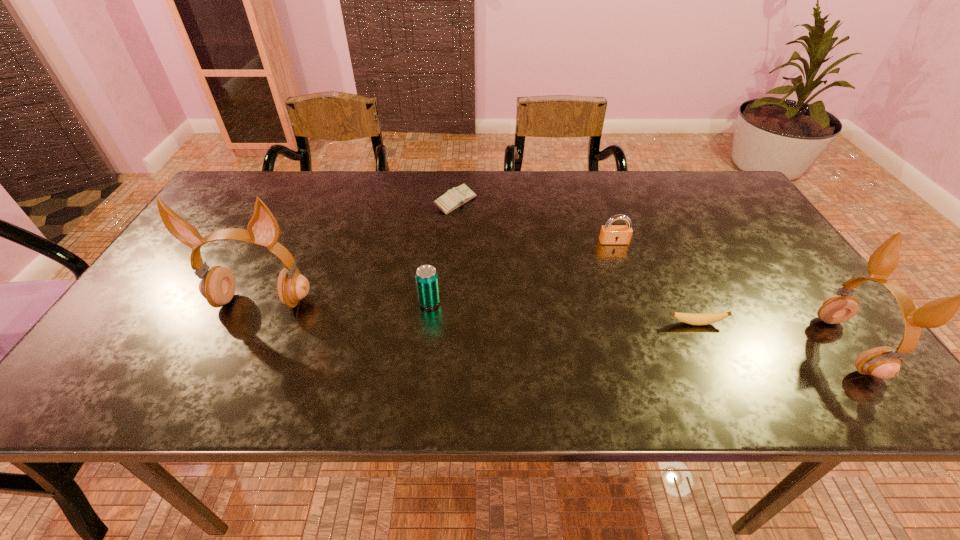
Find the location of a particular element. The height and width of the screenshot is (540, 960). vacant space located on the front of the diary is located at coordinates (448, 300).

Find the location of a particular element. The image size is (960, 540). blank space located on the back of the beer can is located at coordinates (432, 276).

The width and height of the screenshot is (960, 540). I want to click on vacant space situated 0.110m to unlock the padlock from the front, so click(x=624, y=273).

Where is `free space located 0.240m on the back of the fifth object from left to right`? This screenshot has height=540, width=960. free space located 0.240m on the back of the fifth object from left to right is located at coordinates (662, 251).

Find the location of a particular element. object that is at the far edge is located at coordinates (453, 198).

At what (x,y) coordinates should I click in order to perform the action: click on object at the near edge. Please return your answer as a coordinate pair (x, y). The image size is (960, 540). Looking at the image, I should click on (884, 362).

In order to click on object that is at the left edge in this screenshot , I will do `click(217, 286)`.

I want to click on object present at the right edge, so click(x=884, y=362).

You are a GUI agent. You are given a task and a screenshot of the screen. Output one action in this format:
    pyautogui.click(x=<x>, y=<y>)
    Task: Click on the object at the near right corner
    The height and width of the screenshot is (540, 960).
    Given the screenshot: What is the action you would take?
    pyautogui.click(x=884, y=362)

At what (x,y) coordinates should I click in order to perform the action: click on free space at the far edge. Please return your answer as a coordinate pair (x, y). The width and height of the screenshot is (960, 540). Looking at the image, I should click on (512, 211).